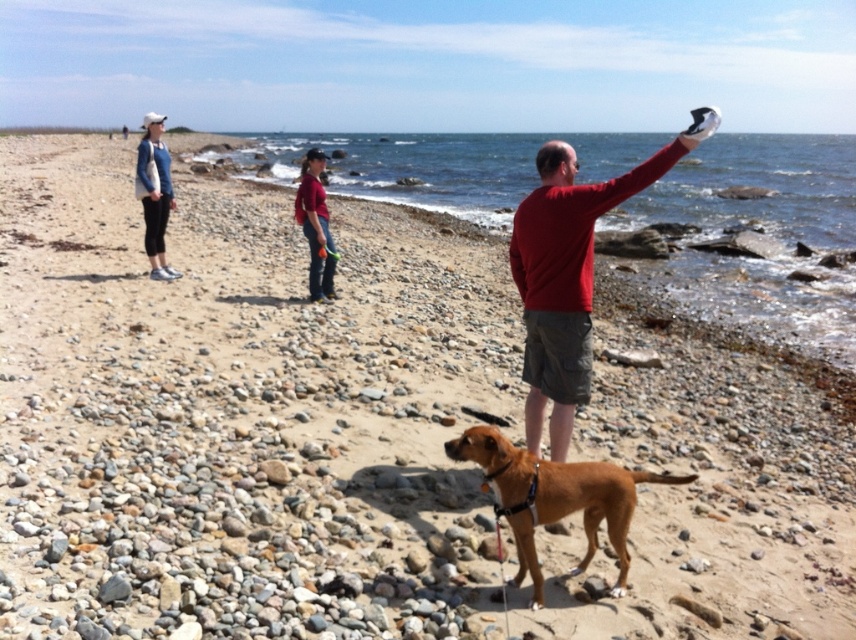
You are a photographer taking a picture of the beach scene. You want to ensure that both the brown leather dog at center and the blue cotton shirt at upper left are clearly visible in the frame. Based on their positions, will the dog be obscured by the shirt?

The brown leather dog at center is positioned under the blue cotton shirt at upper left, so the dog may be partially obscured by the shirt in the photo.

You are a dog trainer standing at the position of the viewer. The dog you are observing is a brown leather dog at center. If the dog suddenly runs towards you, how far will it have to travel to reach you?

The brown leather dog at center and viewer are 3.35 meters apart from each other, so the dog will have to travel 3.35 meters to reach you.